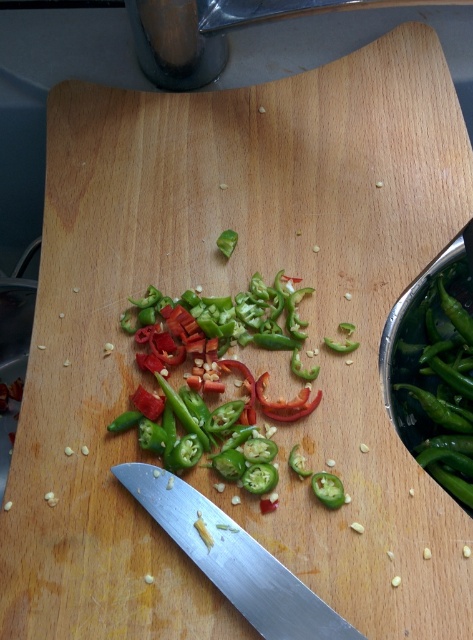
Question: Which point appears farthest from the camera in this image?

Choices:
 (A) (437, 353)
 (B) (297, 598)

Answer: (A)

Question: Is silver metallic knife at lower center smaller than green glossy chili pepper at center?

Choices:
 (A) no
 (B) yes

Answer: (B)

Question: Which object appears closest to the camera in this image?

Choices:
 (A) silver metallic knife at lower center
 (B) green glossy chili pepper at center

Answer: (A)

Question: Is silver metallic knife at lower center to the left of green glossy chili pepper at center from the viewer's perspective?

Choices:
 (A) no
 (B) yes

Answer: (B)

Question: Does silver metallic knife at lower center lie behind green glossy chili pepper at center?

Choices:
 (A) no
 (B) yes

Answer: (A)